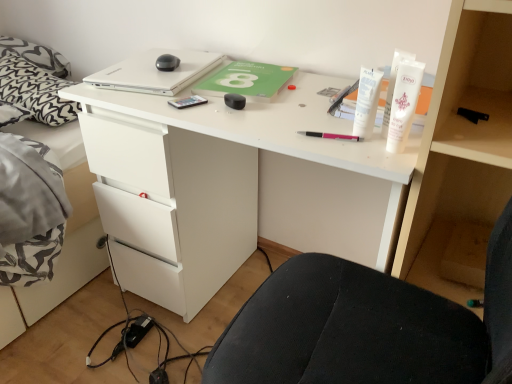
Identify the location of vacant space behind black rubberized mouse at center, arranged as the 3th stationery when viewed from the right. (239, 85).